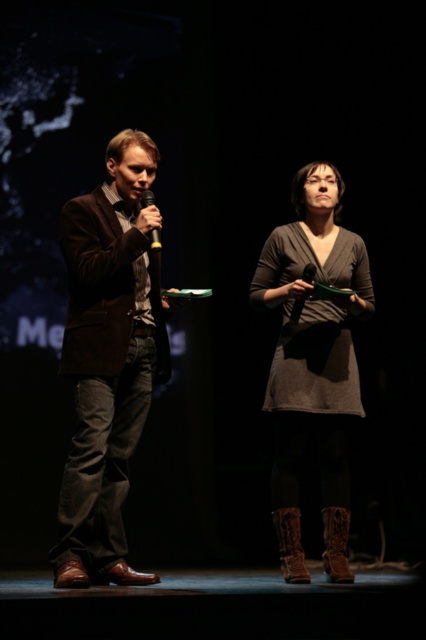
Question: Among these points, which one is nearest to the camera?

Choices:
 (A) (287, 541)
 (B) (311, 236)
 (C) (327, 548)

Answer: (A)

Question: Among these objects, which one is nearest to the camera?

Choices:
 (A) matte brown suit at left
 (B) matte gray dress at center

Answer: (A)

Question: Among these objects, which one is nearest to the camera?

Choices:
 (A) matte gray dress at center
 (B) matte brown suit at left
 (C) black plastic microphone at left

Answer: (B)

Question: Does matte brown suit at left appear under brown leather boot at lower right?

Choices:
 (A) yes
 (B) no

Answer: (B)

Question: Can you confirm if matte brown suit at left is bigger than matte gray dress at center?

Choices:
 (A) yes
 (B) no

Answer: (A)

Question: Does green matte microphone at center lie in front of black plastic microphone at left?

Choices:
 (A) yes
 (B) no

Answer: (B)